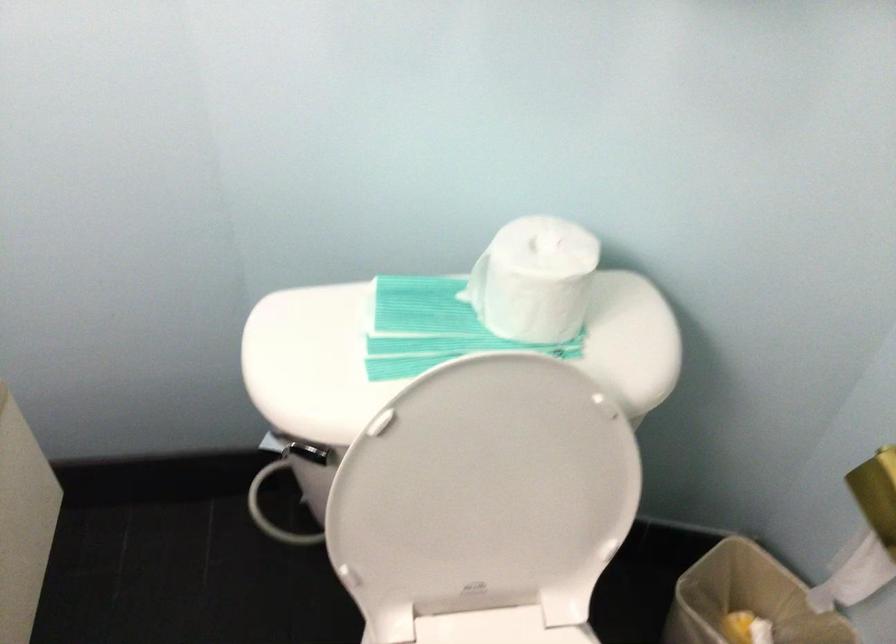
Where would you push the toilet flush handle? Please return your answer as a coordinate pair (x, y).

(272, 446)